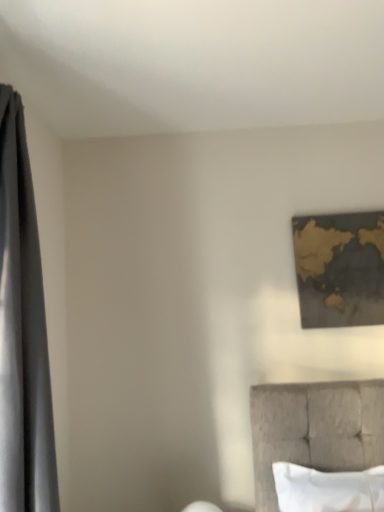
Question: Is silky gray curtain at left in front of or behind white soft pillow at lower right in the image?

Choices:
 (A) front
 (B) behind

Answer: (A)

Question: Based on their sizes in the image, would you say silky gray curtain at left is bigger or smaller than white soft pillow at lower right?

Choices:
 (A) big
 (B) small

Answer: (A)

Question: Estimate the real-world distances between objects in this image. Which object is farther from the white soft pillow at lower right?

Choices:
 (A) gold metallic map at upper right
 (B) silky gray curtain at left

Answer: (B)

Question: Estimate the real-world distances between objects in this image. Which object is closer to the white soft pillow at lower right?

Choices:
 (A) gold metallic map at upper right
 (B) silky gray curtain at left

Answer: (A)